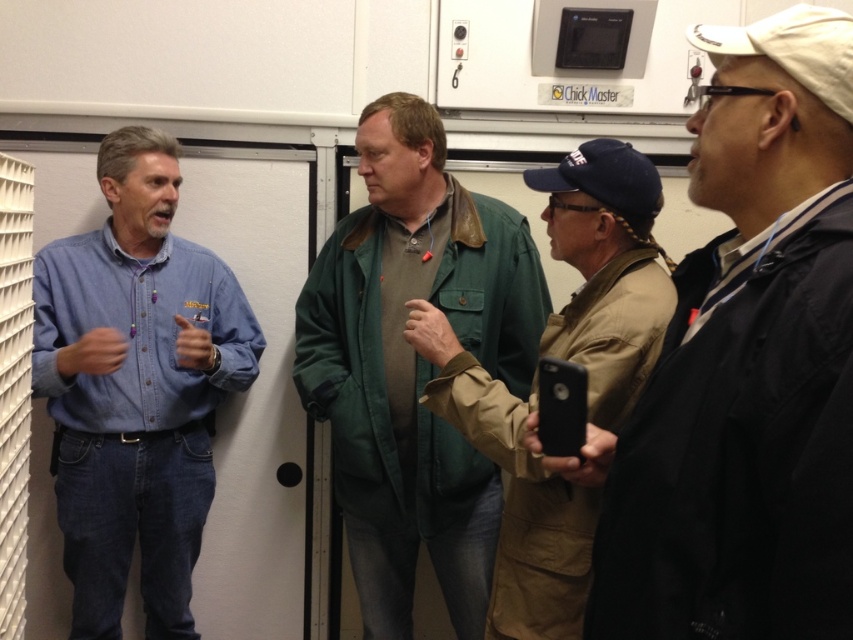
Between denim shirt at left and tan fabric jacket at center, which one is positioned lower?

denim shirt at left

Which is in front, point (68, 356) or point (573, 493)?

Point (573, 493)

At what (x,y) coordinates should I click in order to perform the action: click on denim shirt at left. Please return your answer as a coordinate pair (x, y). Looking at the image, I should click on (135, 387).

Is black matte jacket at right further to the viewer compared to tan fabric jacket at center?

Answer: No, black matte jacket at right is in front of tan fabric jacket at center.

Can you confirm if black matte jacket at right is positioned to the right of tan fabric jacket at center?

Indeed, black matte jacket at right is positioned on the right side of tan fabric jacket at center.

Is point (750, 154) farther from viewer compared to point (575, 632)?

No, (750, 154) is in front of (575, 632).

What are the coordinates of `black matte jacket at right` in the screenshot? It's located at (741, 356).

Is black matte jacket at right to the right of green leather jacket at center from the viewer's perspective?

Yes, black matte jacket at right is to the right of green leather jacket at center.

Who is more forward, (631, 522) or (381, 241)?

Point (631, 522)

Is point (833, 602) more distant than point (421, 538)?

That is False.

You are a GUI agent. You are given a task and a screenshot of the screen. Output one action in this format:
    pyautogui.click(x=<x>, y=<y>)
    Task: Click on the black matte jacket at right
    Image resolution: width=853 pixels, height=640 pixels.
    Given the screenshot: What is the action you would take?
    pyautogui.click(x=741, y=356)